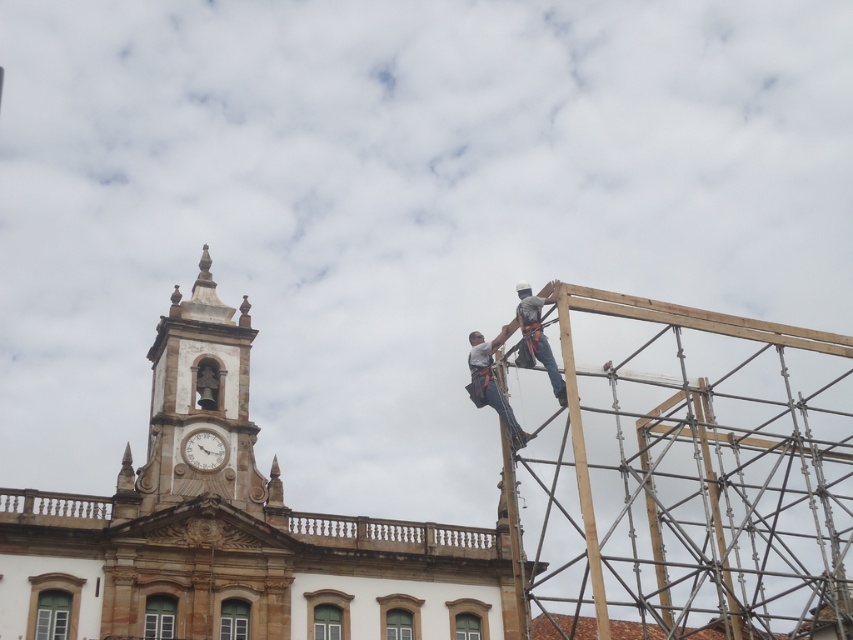
You are standing at the construction site of the historical building. You need to reach a specific point marked at coordinates point (242, 424). If your current distance from the camera is 100 feet, can you safely walk towards the point without getting too close? Please explain using the distance information provided.

The distance of point (242, 424) from the camera is 264.26 feet. Since your current distance is 100 feet, you are still 164.26 feet away from the point. Therefore, you can safely walk towards it without getting too close.

You are a construction inspector reviewing the safety equipment placement in the image. The safety harness must be positioned within the top third of the image to ensure proper access for emergency exits. Is the matte gray harness at upper right placed correctly?

The matte gray harness at upper right is located at point [491,384]. Since the top third of the image would be from y coordinates 0.000 to 0.333, the harness is placed below this area and thus not within the required top third. Therefore, it is not placed correctly.

You are a visitor standing in front of the historical building. You see the white stone clock tower at upper left and the matte gray harness at upper right. Which object is located more to the left side of the scene?

The white stone clock tower at upper left is positioned on the left side of matte gray harness at upper right, so it is more to the left in the scene.